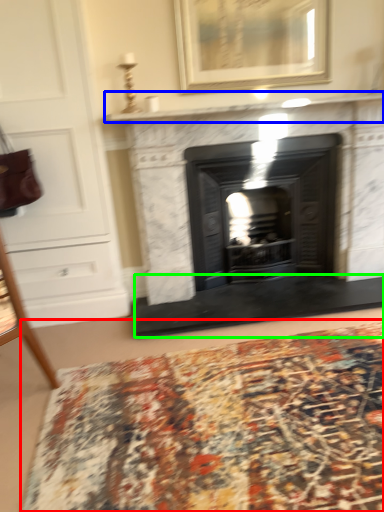
Question: Based on their relative distances, which object is farther from mat (highlighted by a red box)? Choose from mantle (highlighted by a blue box) and doormat (highlighted by a green box).

Choices:
 (A) mantle
 (B) doormat

Answer: (A)